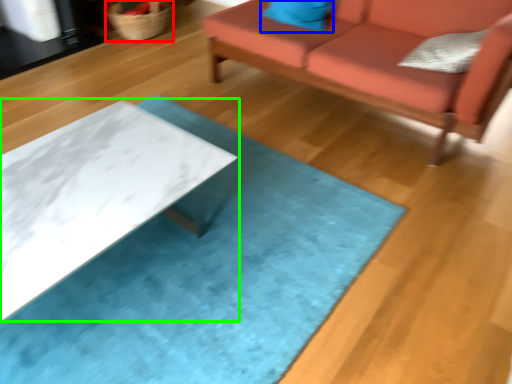
Question: Estimate the real-world distances between objects in this image. Which object is closer to basket (highlighted by a red box), pillow (highlighted by a blue box) or table (highlighted by a green box)?

Choices:
 (A) pillow
 (B) table

Answer: (A)